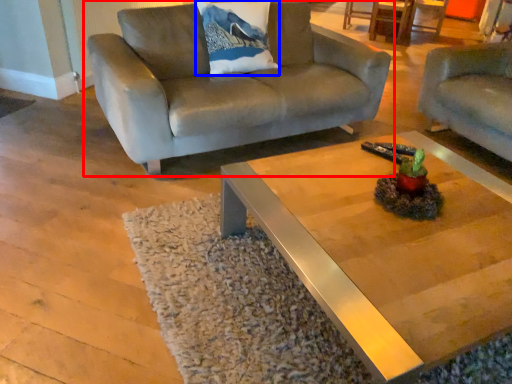
Question: Which point is further to the camera, studio couch (highlighted by a red box) or pillow (highlighted by a blue box)?

Choices:
 (A) studio couch
 (B) pillow

Answer: (B)